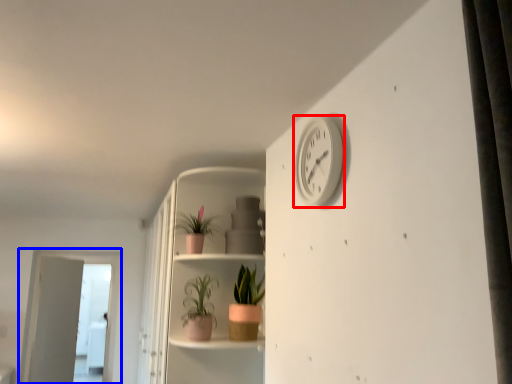
Question: Among these objects, which one is farthest to the camera, clock (highlighted by a red box) or screen door (highlighted by a blue box)?

Choices:
 (A) clock
 (B) screen door

Answer: (B)